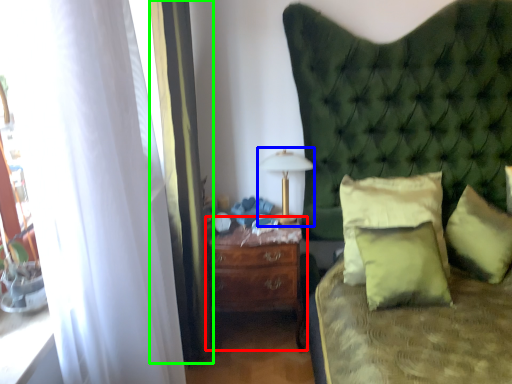
Question: Considering the real-world distances, which object is farthest from nightstand (highlighted by a red box)? bedside lamp (highlighted by a blue box) or curtain (highlighted by a green box)?

Choices:
 (A) bedside lamp
 (B) curtain

Answer: (A)